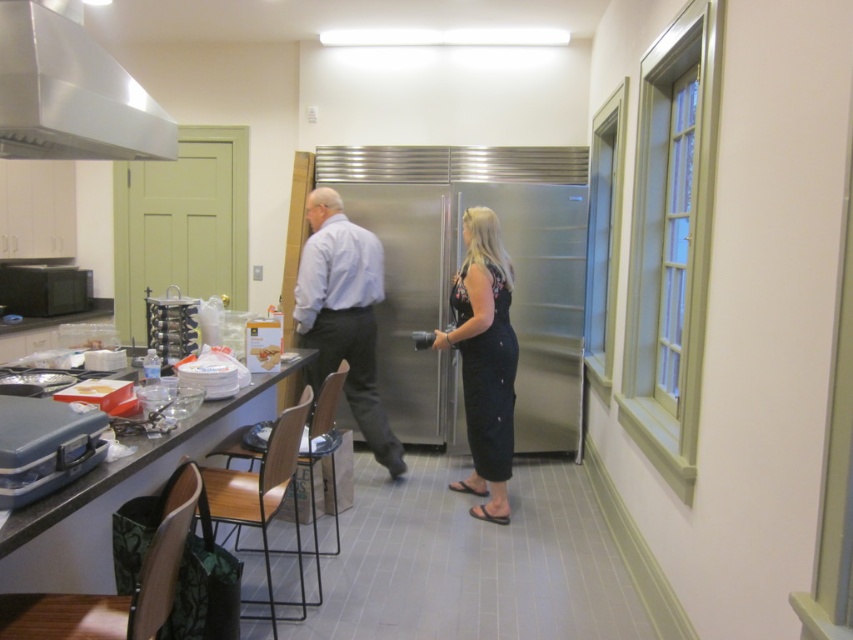
Question: Can you confirm if stainless steel exhaust hood at upper left is positioned below stainless steel refrigerator at center?

Choices:
 (A) yes
 (B) no

Answer: (B)

Question: Which object is farther from the camera taking this photo?

Choices:
 (A) light blue shirt at center
 (B) stainless steel refrigerator at center
 (C) matte black countertop at lower left
 (D) stainless steel exhaust hood at upper left

Answer: (B)

Question: Is stainless steel exhaust hood at upper left smaller than matte black countertop at lower left?

Choices:
 (A) no
 (B) yes

Answer: (A)

Question: Considering the real-world distances, which object is closest to the black floral dress at center?

Choices:
 (A) stainless steel refrigerator at center
 (B) stainless steel exhaust hood at upper left

Answer: (A)

Question: Which point is closer to the camera?

Choices:
 (A) (450, 486)
 (B) (514, 385)
 (C) (375, 413)

Answer: (B)

Question: Does light blue shirt at center come in front of black floral dress at center?

Choices:
 (A) yes
 (B) no

Answer: (B)